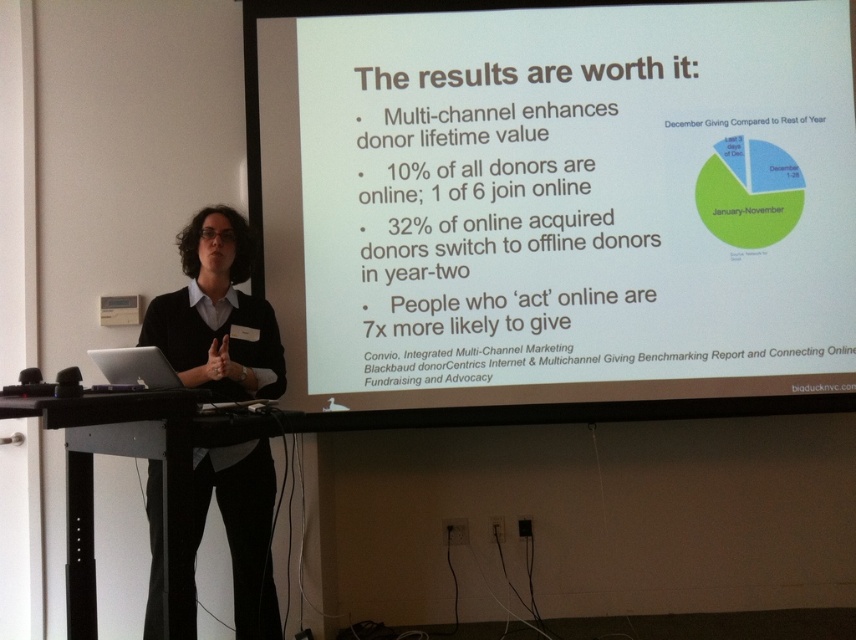
You are a photographer in the audience at this presentation. You want to take a photo of the speaker to capture their facial expression clearly. However, you notice that the black matte sweater at center and the white matte projection screen at upper center might interfere with the lighting. Which object should you be more concerned about in terms of balancing the exposure in your photo?

The black matte sweater at center is behind the white matte projection screen at upper center, so the white screen will reflect more light and may cause overexposure, making it harder to capture the speaker properly. You should prioritize adjusting exposure settings to account for the white matte projection screen at upper center.

You are a stagehand who needs to place a 15 inch wide decorative panel between the black matte sweater at center and the silver metallic laptop at lower left. Is there enough space for it?

The black matte sweater at center is 20.56 inches away from the silver metallic laptop at lower left. Since the decorative panel is 15 inches wide, there is sufficient space to place it between them.